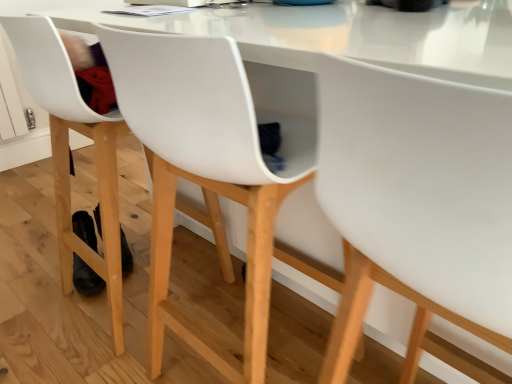
Question: Which direction should I rotate to look at white matte chair at center, placed as the second chair when sorted from right to left, — up or down?

Choices:
 (A) up
 (B) down

Answer: (A)

Question: Does white matte chair at center, which is counted as the first chair, starting from the left, come in front of white matte chair at center, which ranks as the first chair in right-to-left order?

Choices:
 (A) yes
 (B) no

Answer: (B)

Question: Is white matte chair at center, placed as the second chair when sorted from right to left, oriented away from white matte chair at center, which ranks as the first chair in right-to-left order?

Choices:
 (A) yes
 (B) no

Answer: (B)

Question: Is white matte chair at center, which ranks as the first chair in right-to-left order, completely or partially inside white matte chair at center, which is counted as the first chair, starting from the left?

Choices:
 (A) no
 (B) yes

Answer: (A)

Question: From a real-world perspective, is white matte chair at center, which is counted as the first chair, starting from the left, located higher than white matte chair at center, which is the second chair in left-to-right order?

Choices:
 (A) yes
 (B) no

Answer: (B)

Question: Are white matte chair at center, which is counted as the first chair, starting from the left, and white matte chair at center, which is the second chair in left-to-right order, located far from each other?

Choices:
 (A) yes
 (B) no

Answer: (B)

Question: From a real-world perspective, is white matte chair at center, which is counted as the first chair, starting from the left, physically below white matte chair at center, which is the second chair in left-to-right order?

Choices:
 (A) yes
 (B) no

Answer: (A)

Question: Is white matte chair at center, which ranks as the first chair in right-to-left order, positioned far away from white matte chair at center, placed as the second chair when sorted from right to left?

Choices:
 (A) yes
 (B) no

Answer: (B)

Question: Is white matte chair at center, which ranks as the first chair in right-to-left order, to the left of white matte chair at center, which is counted as the first chair, starting from the left, from the viewer's perspective?

Choices:
 (A) yes
 (B) no

Answer: (B)

Question: From a real-world perspective, is white matte chair at center, which is the second chair in left-to-right order, physically below white matte chair at center, placed as the second chair when sorted from right to left?

Choices:
 (A) yes
 (B) no

Answer: (B)

Question: Is white matte chair at center, which ranks as the first chair in right-to-left order, shorter than white matte chair at center, which is counted as the first chair, starting from the left?

Choices:
 (A) no
 (B) yes

Answer: (A)

Question: Does white matte chair at center, which ranks as the first chair in right-to-left order, have a lesser width compared to white matte chair at center, placed as the second chair when sorted from right to left?

Choices:
 (A) no
 (B) yes

Answer: (B)

Question: Considering the relative sizes of white matte chair at center, which ranks as the first chair in right-to-left order, and white matte chair at center, which is counted as the first chair, starting from the left, in the image provided, is white matte chair at center, which ranks as the first chair in right-to-left order, taller than white matte chair at center, which is counted as the first chair, starting from the left,?

Choices:
 (A) no
 (B) yes

Answer: (B)

Question: Considering the positions of white matte chair at center, which is the second chair in left-to-right order, and white matte chair at center, which is counted as the first chair, starting from the left, in the image, is white matte chair at center, which is the second chair in left-to-right order, bigger or smaller than white matte chair at center, which is counted as the first chair, starting from the left,?

Choices:
 (A) small
 (B) big

Answer: (A)